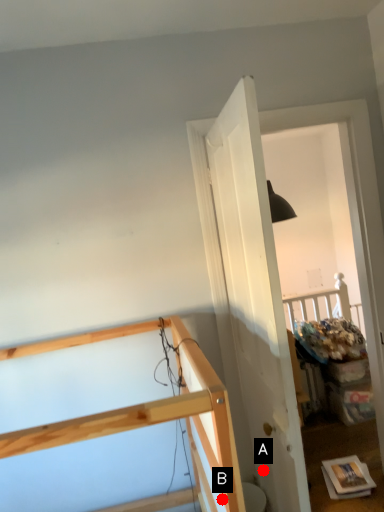
Question: Two points are circled on the image, labeled by A and B beside each circle. Which point is farther from the camera taking this photo?

Choices:
 (A) A is further
 (B) B is further

Answer: (A)